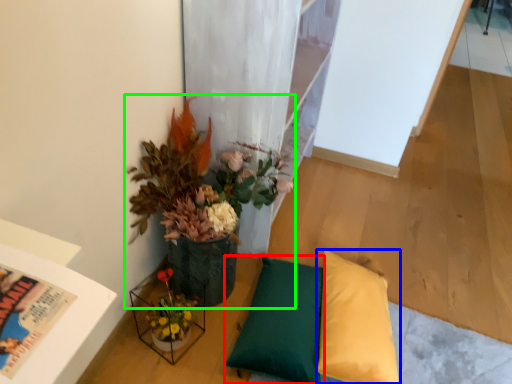
Question: Estimate the real-world distances between objects in this image. Which object is farther from pillow (highlighted by a red box), pillow (highlighted by a blue box) or houseplant (highlighted by a green box)?

Choices:
 (A) pillow
 (B) houseplant

Answer: (B)